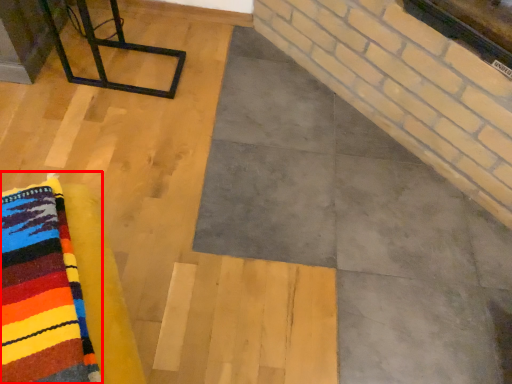
Question: Where is cloth (annotated by the red box) located in relation to furniture in the image?

Choices:
 (A) right
 (B) left

Answer: (A)